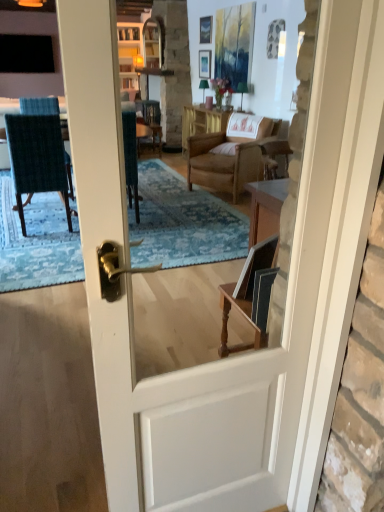
Question: Considering the positions of point tap(34, 41) and point tap(205, 72), is point tap(34, 41) closer or farther from the camera than point tap(205, 72)?

Choices:
 (A) closer
 (B) farther

Answer: (A)

Question: Looking at the image, does black glass window at upper left seem bigger or smaller compared to matte white picture frame at upper center, the 1th picture frame ordered from the bottom?

Choices:
 (A) small
 (B) big

Answer: (B)

Question: Which of these objects is positioned farthest from the wooden picture frame at upper center, the first picture frame in the top-to-bottom sequence?

Choices:
 (A) dark blue textured fabric chair at left
 (B) black glass window at upper left
 (C) wooden table at center
 (D) matte white picture frame at upper center, the 1th picture frame ordered from the bottom

Answer: (A)

Question: Which object is positioned closest to the matte white picture frame at upper center, the 1th picture frame ordered from the bottom?

Choices:
 (A) black glass window at upper left
 (B) wooden table at center
 (C) dark blue textured fabric chair at left
 (D) wooden picture frame at upper center, the first picture frame in the top-to-bottom sequence

Answer: (D)